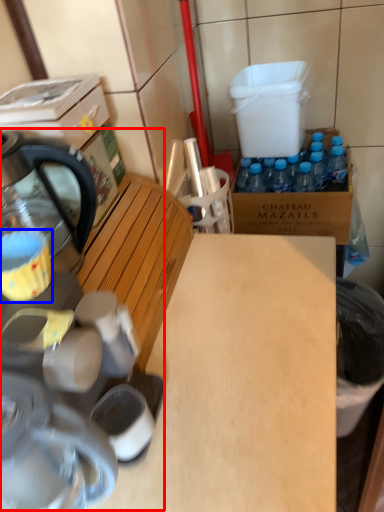
Question: Which point is further to the camera, coffee machine (highlighted by a red box) or coffee cup (highlighted by a blue box)?

Choices:
 (A) coffee machine
 (B) coffee cup

Answer: (B)